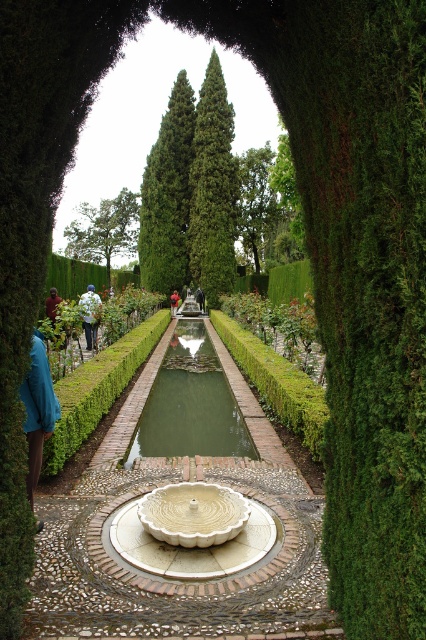
You are planning to place a decorative item on the central water channel in the garden. You have a white cotton jacket at center and a blue fabric at center. Which item would you choose if you want something that takes up more space?

The white cotton jacket at center has a larger size compared to the blue fabric at center, so it would be the better choice if you want something that takes up more space.

In the scene shown: You are planning to place a new teal fabric jacket at lower left near the green concrete pond at center. Since the pond is wider than the jacket, will the jacket fit comfortably next to the pond without overlapping?

The green concrete pond at center is wider than the teal fabric jacket at lower left, so the jacket will fit comfortably next to the pond without overlapping.